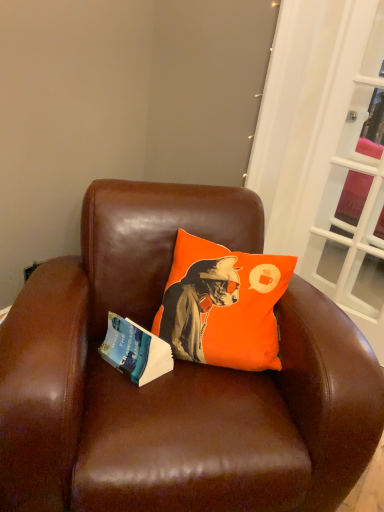
Question: Can you confirm if blue paper book at left is wider than white glass screen door at right?

Choices:
 (A) yes
 (B) no

Answer: (A)

Question: Does blue paper book at left come in front of white glass screen door at right?

Choices:
 (A) yes
 (B) no

Answer: (A)

Question: Does blue paper book at left have a lesser width compared to white glass screen door at right?

Choices:
 (A) no
 (B) yes

Answer: (A)

Question: From the image's perspective, is blue paper book at left under white glass screen door at right?

Choices:
 (A) no
 (B) yes

Answer: (B)

Question: Is blue paper book at left not near white glass screen door at right?

Choices:
 (A) yes
 (B) no

Answer: (A)

Question: Considering the positions of orange fabric pillow at center and white glass screen door at right in the image, is orange fabric pillow at center bigger or smaller than white glass screen door at right?

Choices:
 (A) small
 (B) big

Answer: (B)

Question: Is orange fabric pillow at center taller or shorter than white glass screen door at right?

Choices:
 (A) short
 (B) tall

Answer: (A)

Question: Is point (264, 346) positioned closer to the camera than point (372, 288)?

Choices:
 (A) closer
 (B) farther

Answer: (A)

Question: From a real-world perspective, relative to white glass screen door at right, is orange fabric pillow at center vertically above or below?

Choices:
 (A) below
 (B) above

Answer: (A)

Question: Is blue paper book at left bigger or smaller than orange fabric pillow at center?

Choices:
 (A) big
 (B) small

Answer: (B)

Question: Is blue paper book at left spatially inside orange fabric pillow at center, or outside of it?

Choices:
 (A) inside
 (B) outside

Answer: (B)

Question: Is blue paper book at left taller or shorter than orange fabric pillow at center?

Choices:
 (A) short
 (B) tall

Answer: (A)

Question: Does point (155, 350) appear closer or farther from the camera than point (201, 279)?

Choices:
 (A) closer
 (B) farther

Answer: (A)

Question: Is white glass screen door at right in front of or behind blue paper book at left in the image?

Choices:
 (A) front
 (B) behind

Answer: (B)

Question: Which is correct: white glass screen door at right is inside blue paper book at left, or outside of it?

Choices:
 (A) inside
 (B) outside

Answer: (B)